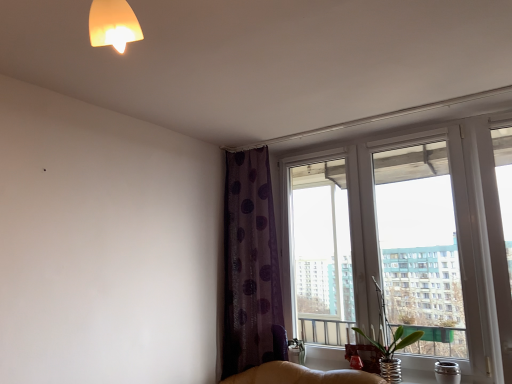
Question: Is green glass vase at window facing towards purple dotted fabric at upper center?

Choices:
 (A) no
 (B) yes

Answer: (A)

Question: Is green glass vase at window positioned with its back to purple dotted fabric at upper center?

Choices:
 (A) no
 (B) yes

Answer: (A)

Question: Considering the relative sizes of green glass vase at window and purple dotted fabric at upper center in the image provided, is green glass vase at window taller than purple dotted fabric at upper center?

Choices:
 (A) no
 (B) yes

Answer: (A)

Question: From a real-world perspective, is green glass vase at window physically above purple dotted fabric at upper center?

Choices:
 (A) yes
 (B) no

Answer: (B)

Question: Would you say green glass vase at window is a long distance from purple dotted fabric at upper center?

Choices:
 (A) yes
 (B) no

Answer: (B)

Question: From the image's perspective, does green glass vase at window appear lower than purple dotted fabric at upper center?

Choices:
 (A) no
 (B) yes

Answer: (B)

Question: Is transparent glass window at upper right positioned with its back to green glass vase at window?

Choices:
 (A) yes
 (B) no

Answer: (A)

Question: Is transparent glass window at upper right next to green glass vase at window and touching it?

Choices:
 (A) yes
 (B) no

Answer: (B)

Question: Can you confirm if transparent glass window at upper right is taller than green glass vase at window?

Choices:
 (A) yes
 (B) no

Answer: (A)

Question: Could you tell me if transparent glass window at upper right is turned towards green glass vase at window?

Choices:
 (A) yes
 (B) no

Answer: (A)

Question: Considering the relative positions of transparent glass window at upper right and green glass vase at window in the image provided, is transparent glass window at upper right behind green glass vase at window?

Choices:
 (A) no
 (B) yes

Answer: (A)

Question: From a real-world perspective, is transparent glass window at upper right below green glass vase at window?

Choices:
 (A) yes
 (B) no

Answer: (B)

Question: Can we say transparent glass window at upper right lies outside purple dotted fabric at upper center?

Choices:
 (A) no
 (B) yes

Answer: (B)